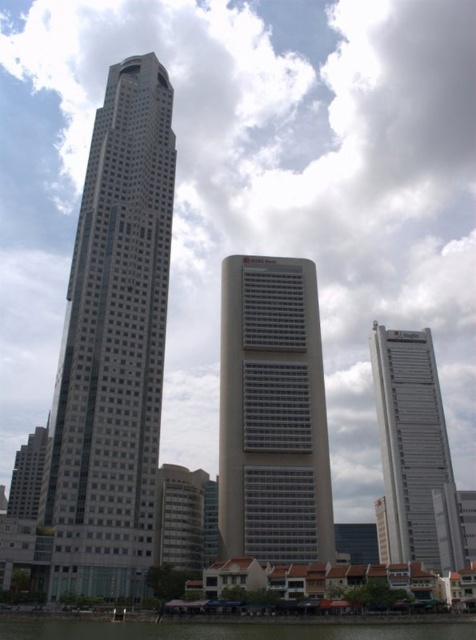
Question: Does gray concrete building at center appear under green water at lower center?

Choices:
 (A) yes
 (B) no

Answer: (B)

Question: Which of these objects is positioned closest to the gray concrete building at center?

Choices:
 (A) gray glass skyscraper at left
 (B) green water at lower center
 (C) white glass tower at right

Answer: (A)

Question: Which point is farther to the camera?

Choices:
 (A) (303, 436)
 (B) (426, 456)
 (C) (100, 134)

Answer: (B)

Question: Which of the following is the closest to the observer?

Choices:
 (A) (393, 428)
 (B) (311, 284)
 (C) (418, 636)

Answer: (C)

Question: Is gray concrete building at center closer to camera compared to white glass tower at right?

Choices:
 (A) yes
 (B) no

Answer: (A)

Question: Observing the image, what is the correct spatial positioning of white glass tower at right in reference to green water at lower center?

Choices:
 (A) right
 (B) left

Answer: (A)